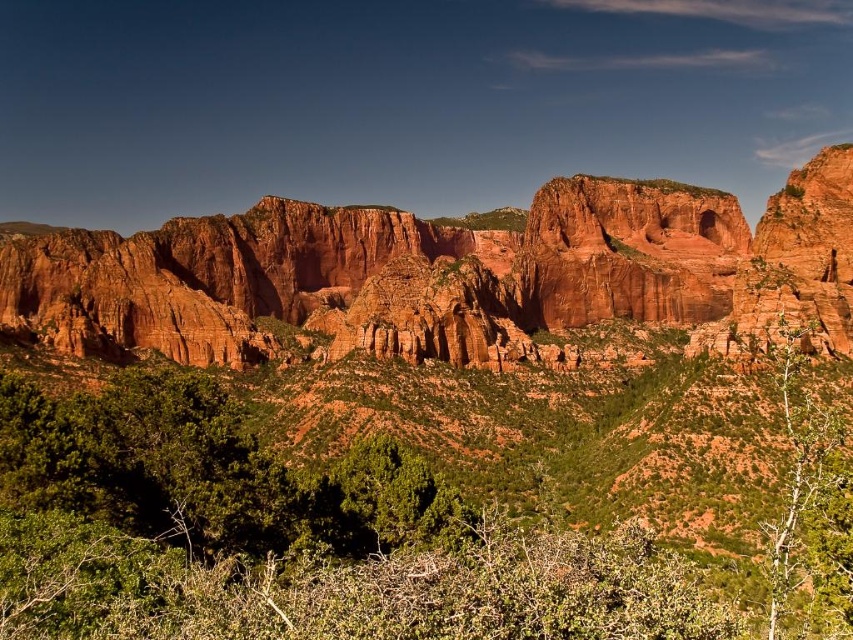
Question: Which point appears closest to the camera in this image?

Choices:
 (A) (329, 477)
 (B) (836, 609)
 (C) (161, 449)

Answer: (B)

Question: Based on their relative distances, which object is nearer to the green leafy shrubs at center?

Choices:
 (A) rustic rock formation at center
 (B) green leafy tree at center
 (C) green leafy tree at right

Answer: (B)

Question: Can you confirm if green leafy shrubs at center is positioned to the right of green leafy tree at center?

Choices:
 (A) yes
 (B) no

Answer: (B)

Question: Where is green leafy tree at right located in relation to green leafy tree at center in the image?

Choices:
 (A) below
 (B) above

Answer: (B)

Question: Can you confirm if green leafy shrubs at center is thinner than rustic rock formation at center?

Choices:
 (A) yes
 (B) no

Answer: (A)

Question: Which object is positioned closest to the green leafy tree at right?

Choices:
 (A) green leafy shrubs at center
 (B) rustic rock formation at center
 (C) green leafy tree at center

Answer: (A)